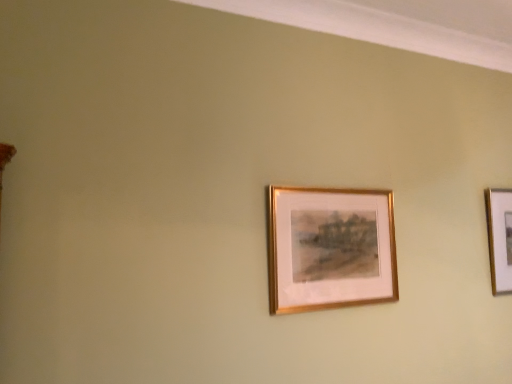
The image size is (512, 384). Describe the element at coordinates (330, 248) in the screenshot. I see `gold metallic picture frame at center, which appears as the second picture frame when viewed from the back` at that location.

Locate an element on the screen. Image resolution: width=512 pixels, height=384 pixels. gold metallic picture frame at center, placed as the first picture frame when sorted from left to right is located at coordinates (330, 248).

Measure the distance between gold metallic picture frame at center, which appears as the second picture frame when viewed from the back, and camera.

gold metallic picture frame at center, which appears as the second picture frame when viewed from the back, and camera are 4.49 feet apart from each other.

What is the approximate width of gold metallic picture frame at center, which appears as the second picture frame when viewed from the back?

gold metallic picture frame at center, which appears as the second picture frame when viewed from the back, is 4.30 centimeters in width.

This screenshot has width=512, height=384. What do you see at coordinates (499, 238) in the screenshot? I see `gold metallic picture frame at right, the second picture frame positioned from the left` at bounding box center [499, 238].

I want to click on gold metallic picture frame at right, which is the second picture frame in front-to-back order, so click(499, 238).

Identify the location of gold metallic picture frame at center, placed as the first picture frame when sorted from left to right. (330, 248).

Is gold metallic picture frame at right, which is the second picture frame in front-to-back order, to the right of gold metallic picture frame at center, placed as the first picture frame when sorted from left to right, from the viewer's perspective?

Yes, gold metallic picture frame at right, which is the second picture frame in front-to-back order, is to the right of gold metallic picture frame at center, placed as the first picture frame when sorted from left to right.

Is gold metallic picture frame at right, marked as the 1th picture frame in a right-to-left arrangement, further to the viewer compared to gold metallic picture frame at center, which is counted as the first picture frame, starting from the front?

Yes, gold metallic picture frame at right, marked as the 1th picture frame in a right-to-left arrangement, is further from the camera.

Is point (501, 230) closer to viewer compared to point (375, 269)?

That is False.

From the image's perspective, is gold metallic picture frame at right, the second picture frame positioned from the left, above or below gold metallic picture frame at center, which appears as the second picture frame when viewed from the back?

Based on their image positions, gold metallic picture frame at right, the second picture frame positioned from the left, is located beneath gold metallic picture frame at center, which appears as the second picture frame when viewed from the back.

From a real-world perspective, is gold metallic picture frame at right, the second picture frame positioned from the left, under gold metallic picture frame at center, placed as the first picture frame when sorted from left to right?

No, from a real-world perspective, gold metallic picture frame at right, the second picture frame positioned from the left, is not under gold metallic picture frame at center, placed as the first picture frame when sorted from left to right.

Which of these two, gold metallic picture frame at right, which is the second picture frame in front-to-back order, or gold metallic picture frame at center, which is counted as the first picture frame, starting from the front, is thinner?

With smaller width is gold metallic picture frame at center, which is counted as the first picture frame, starting from the front.

Based on the photo, between gold metallic picture frame at right, the second picture frame positioned from the left, and gold metallic picture frame at center, which is counted as the first picture frame, starting from the front, which one has more height?

gold metallic picture frame at right, the second picture frame positioned from the left, is taller.

Is gold metallic picture frame at right, which is the second picture frame in front-to-back order, bigger or smaller than gold metallic picture frame at center, which appears as the second picture frame when viewed from the back?

Clearly, gold metallic picture frame at right, which is the second picture frame in front-to-back order, is smaller in size than gold metallic picture frame at center, which appears as the second picture frame when viewed from the back.

Consider the image. Is gold metallic picture frame at right, which is the second picture frame in front-to-back order, situated inside gold metallic picture frame at center, which is counted as the first picture frame, starting from the front, or outside?

gold metallic picture frame at right, which is the second picture frame in front-to-back order, is located beyond the bounds of gold metallic picture frame at center, which is counted as the first picture frame, starting from the front.

Is the surface of gold metallic picture frame at right, the second picture frame positioned from the left, in direct contact with gold metallic picture frame at center, which is counted as the first picture frame, starting from the front?

No, gold metallic picture frame at right, the second picture frame positioned from the left, is not beside gold metallic picture frame at center, which is counted as the first picture frame, starting from the front.

Does gold metallic picture frame at right, which appears as the first picture frame when viewed from the back, turn towards gold metallic picture frame at center, which is counted as the first picture frame, starting from the front?

No, gold metallic picture frame at right, which appears as the first picture frame when viewed from the back, is not aimed at gold metallic picture frame at center, which is counted as the first picture frame, starting from the front.

How different are the orientations of gold metallic picture frame at right, which appears as the first picture frame when viewed from the back, and gold metallic picture frame at center, placed as the first picture frame when sorted from left to right, in degrees?

The angle between the facing direction of gold metallic picture frame at right, which appears as the first picture frame when viewed from the back, and the facing direction of gold metallic picture frame at center, placed as the first picture frame when sorted from left to right, is 0.126 degrees.

How much distance is there between gold metallic picture frame at right, marked as the 1th picture frame in a right-to-left arrangement, and gold metallic picture frame at center, placed as the first picture frame when sorted from left to right?

gold metallic picture frame at right, marked as the 1th picture frame in a right-to-left arrangement, is 30.71 inches away from gold metallic picture frame at center, placed as the first picture frame when sorted from left to right.

There is a gold metallic picture frame at center, the second picture frame in the right-to-left sequence. Identify the location of picture frame above it (from a real-world perspective). Image resolution: width=512 pixels, height=384 pixels. pyautogui.click(x=499, y=238).

Between gold metallic picture frame at center, placed as the first picture frame when sorted from left to right, and gold metallic picture frame at right, the second picture frame positioned from the left, which one appears on the left side from the viewer's perspective?

From the viewer's perspective, gold metallic picture frame at center, placed as the first picture frame when sorted from left to right, appears more on the left side.

Considering the relative positions of gold metallic picture frame at center, which appears as the second picture frame when viewed from the back, and gold metallic picture frame at right, which is the second picture frame in front-to-back order, in the image provided, is gold metallic picture frame at center, which appears as the second picture frame when viewed from the back, behind gold metallic picture frame at right, which is the second picture frame in front-to-back order,?

No, the depth of gold metallic picture frame at center, which appears as the second picture frame when viewed from the back, is less than that of gold metallic picture frame at right, which is the second picture frame in front-to-back order.

Between point (293, 236) and point (504, 239), which one is positioned behind?

The point (504, 239) is farther.

From the image's perspective, does gold metallic picture frame at center, which is counted as the first picture frame, starting from the front, appear higher than gold metallic picture frame at right, which is the second picture frame in front-to-back order?

Yes.

From the picture: From a real-world perspective, is gold metallic picture frame at center, the second picture frame in the right-to-left sequence, physically located above or below gold metallic picture frame at right, which appears as the first picture frame when viewed from the back?

In terms of real-world spatial position, gold metallic picture frame at center, the second picture frame in the right-to-left sequence, is below gold metallic picture frame at right, which appears as the first picture frame when viewed from the back.

Considering the sizes of gold metallic picture frame at center, which appears as the second picture frame when viewed from the back, and gold metallic picture frame at right, marked as the 1th picture frame in a right-to-left arrangement, in the image, is gold metallic picture frame at center, which appears as the second picture frame when viewed from the back, wider or thinner than gold metallic picture frame at right, marked as the 1th picture frame in a right-to-left arrangement,?

Clearly, gold metallic picture frame at center, which appears as the second picture frame when viewed from the back, has less width compared to gold metallic picture frame at right, marked as the 1th picture frame in a right-to-left arrangement.

Does gold metallic picture frame at center, which appears as the second picture frame when viewed from the back, have a greater height compared to gold metallic picture frame at right, marked as the 1th picture frame in a right-to-left arrangement?

No.

Considering the relative sizes of gold metallic picture frame at center, placed as the first picture frame when sorted from left to right, and gold metallic picture frame at right, marked as the 1th picture frame in a right-to-left arrangement, in the image provided, is gold metallic picture frame at center, placed as the first picture frame when sorted from left to right, smaller than gold metallic picture frame at right, marked as the 1th picture frame in a right-to-left arrangement,?

No, gold metallic picture frame at center, placed as the first picture frame when sorted from left to right, is not smaller than gold metallic picture frame at right, marked as the 1th picture frame in a right-to-left arrangement.

Is gold metallic picture frame at center, placed as the first picture frame when sorted from left to right, situated inside gold metallic picture frame at right, the second picture frame positioned from the left, or outside?

gold metallic picture frame at center, placed as the first picture frame when sorted from left to right, is not inside gold metallic picture frame at right, the second picture frame positioned from the left, it's outside.

Are gold metallic picture frame at center, which appears as the second picture frame when viewed from the back, and gold metallic picture frame at right, which is the second picture frame in front-to-back order, beside each other?

gold metallic picture frame at center, which appears as the second picture frame when viewed from the back, and gold metallic picture frame at right, which is the second picture frame in front-to-back order, are clearly separated.

Does gold metallic picture frame at center, which appears as the second picture frame when viewed from the back, turn towards gold metallic picture frame at right, which is the second picture frame in front-to-back order?

No, gold metallic picture frame at center, which appears as the second picture frame when viewed from the back, is not turned towards gold metallic picture frame at right, which is the second picture frame in front-to-back order.

Locate an element on the screen. This screenshot has width=512, height=384. picture frame above the gold metallic picture frame at right, which is the second picture frame in front-to-back order (from the image's perspective) is located at coordinates (330, 248).

Where is `picture frame below the gold metallic picture frame at center, the second picture frame in the right-to-left sequence (from the image's perspective)`? picture frame below the gold metallic picture frame at center, the second picture frame in the right-to-left sequence (from the image's perspective) is located at coordinates (499, 238).

Locate an element on the screen. picture frame below the gold metallic picture frame at right, which is the second picture frame in front-to-back order (from a real-world perspective) is located at coordinates (330, 248).